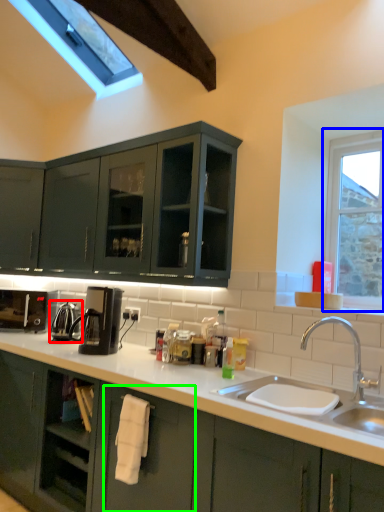
Question: Which object is positioned closest to appliance (highlighted by a red box)? Select from window (highlighted by a blue box) and drawer (highlighted by a green box).

Choices:
 (A) window
 (B) drawer

Answer: (B)